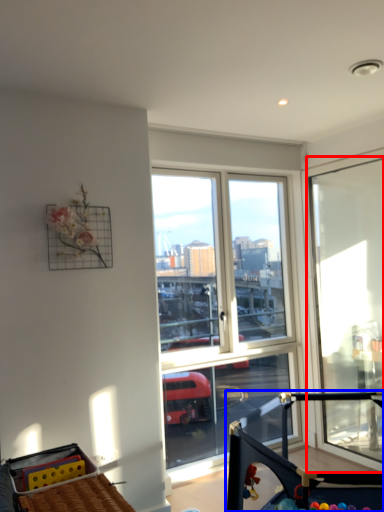
Question: Which object is further to the camera taking this photo, window (highlighted by a red box) or baby carriage (highlighted by a blue box)?

Choices:
 (A) window
 (B) baby carriage

Answer: (A)